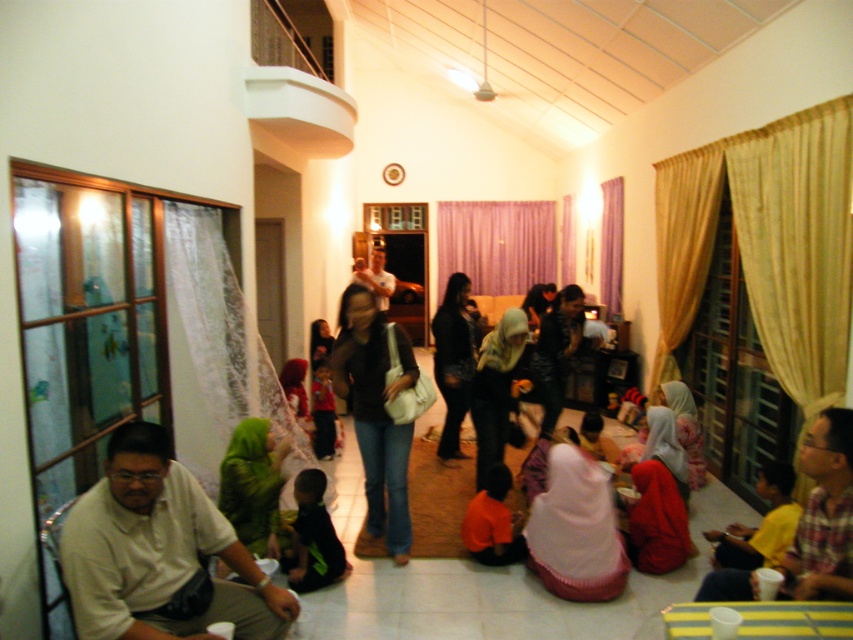
You are a photographer taking a photo of the scene. You notice the green fabric headscarf at center and the orange fabric shirt at lower center. Which object should you focus on if you want to capture the larger one in the image?

The green fabric headscarf at center is larger in size than the orange fabric shirt at lower center, so you should focus on the green fabric headscarf at center to capture the larger one in the image.

You are standing at the entrance of the room and want to locate the green fabric headscarf at center. According to the coordinates provided, in which general direction should you look to find it?

Answer: The green fabric headscarf at center is located at coordinates point [253,484]. Since the coordinate system is not specified, but assuming standard image coordinates where x increases to the right and y increases downward, the headscarf would be towards the lower right of the image. Therefore, you should look towards the lower right direction from the entrance to find it.

You are at a family gathering and want to greet someone wearing a green fabric headscarf at center and another person wearing a black leather jacket at center. In which direction should you turn first to approach both starting from the entrance?

You should turn left first to approach the green fabric headscarf at center since it is to the left of the black leather jacket at center, and then turn right to reach the black leather jacket at center.